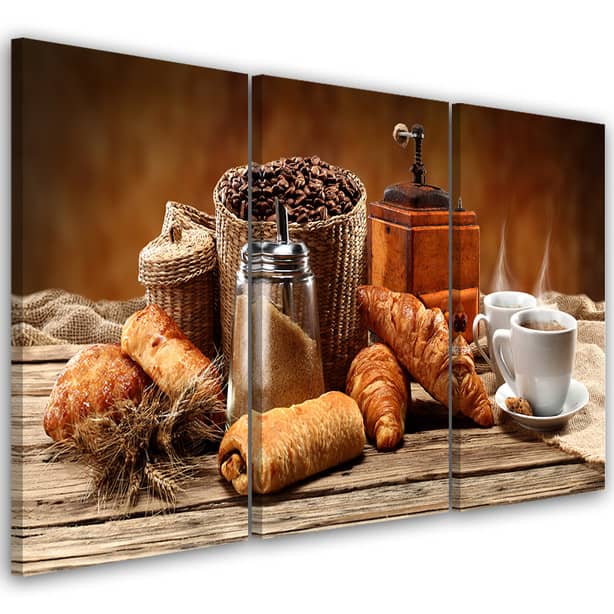
Where is `wooden table`? The height and width of the screenshot is (614, 614). wooden table is located at coordinates (389, 476), (370, 503), (37, 488).